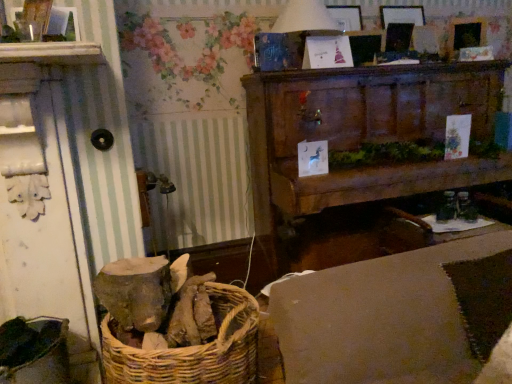
Question: In terms of size, does white paper lampshade at upper center appear bigger or smaller than beige fabric couch at lower right?

Choices:
 (A) small
 (B) big

Answer: (A)

Question: Considering their positions, is white paper lampshade at upper center located in front of or behind beige fabric couch at lower right?

Choices:
 (A) front
 (B) behind

Answer: (B)

Question: Considering the real-world distances, which object is farthest from the white paper lampshade at upper center?

Choices:
 (A) beige fabric couch at lower right
 (B) wooden cabinet at upper center

Answer: (A)

Question: Considering the real-world distances, which object is closest to the white paper lampshade at upper center?

Choices:
 (A) beige fabric couch at lower right
 (B) wooden cabinet at upper center

Answer: (B)